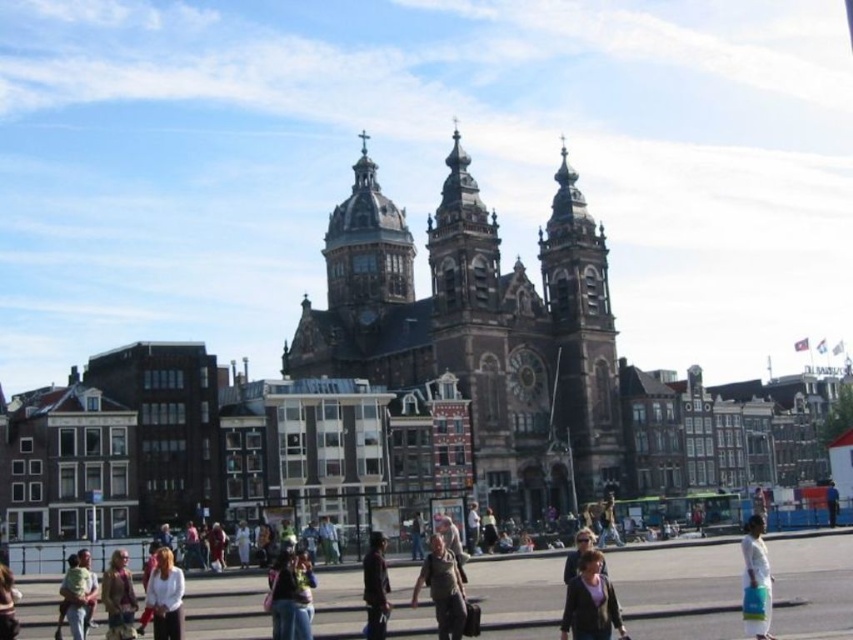
Who is higher up, white matte jacket at lower right or light brown leather jacket at center?

Positioned higher is white matte jacket at lower right.

Does point (759, 522) lie behind point (584, 529)?

No, it is not.

The height and width of the screenshot is (640, 853). What are the coordinates of `white matte jacket at lower right` in the screenshot? It's located at (756, 573).

How far apart are denim jacket at lower left and light brown leather jacket at center?

denim jacket at lower left and light brown leather jacket at center are 74.33 feet apart.

Is denim jacket at lower left thinner than light brown leather jacket at center?

Result: In fact, denim jacket at lower left might be wider than light brown leather jacket at center.

What do you see at coordinates (119, 596) in the screenshot?
I see `denim jacket at lower left` at bounding box center [119, 596].

Locate an element on the screen. denim jacket at lower left is located at coordinates (119, 596).

Does dark brown stone church at center appear under dark brown leather jacket at lower left?

Actually, dark brown stone church at center is above dark brown leather jacket at lower left.

Which is in front, point (514, 339) or point (10, 621)?

Point (10, 621) is in front.

In order to click on dark brown stone church at center in this screenshot , I will do 479,332.